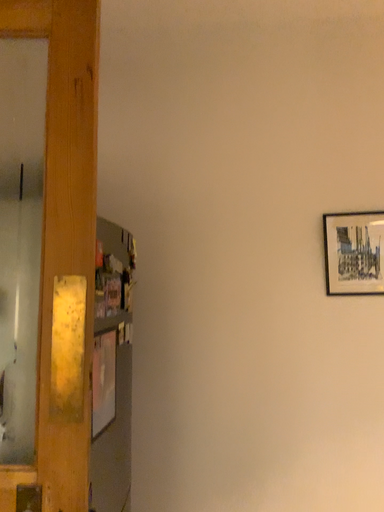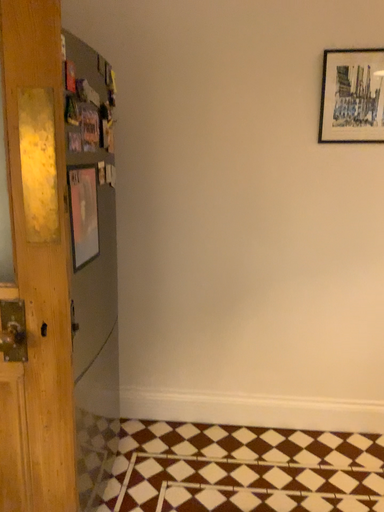
Question: Which way did the camera rotate in the video?

Choices:
 (A) rotated downward
 (B) rotated upward

Answer: (A)